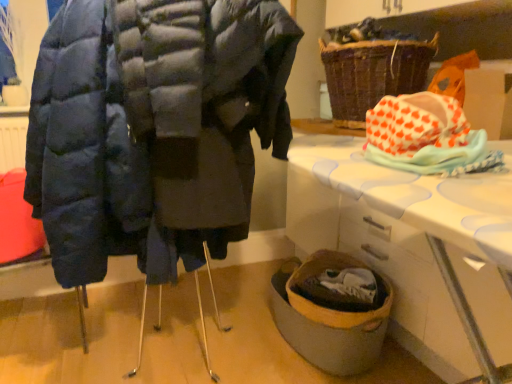
Question: Does matte blue puffer coat at left appear on the left side of orange heart-patterned fabric at upper right?

Choices:
 (A) yes
 (B) no

Answer: (A)

Question: Is matte blue puffer coat at left oriented away from orange heart-patterned fabric at upper right?

Choices:
 (A) no
 (B) yes

Answer: (A)

Question: From a real-world perspective, is matte blue puffer coat at left physically above orange heart-patterned fabric at upper right?

Choices:
 (A) no
 (B) yes

Answer: (A)

Question: Considering the relative sizes of matte blue puffer coat at left and orange heart-patterned fabric at upper right in the image provided, is matte blue puffer coat at left thinner than orange heart-patterned fabric at upper right?

Choices:
 (A) no
 (B) yes

Answer: (A)

Question: From a real-world perspective, is matte blue puffer coat at left located beneath orange heart-patterned fabric at upper right?

Choices:
 (A) no
 (B) yes

Answer: (B)

Question: From a real-world perspective, is matte blue puffer coat at left physically located above or below brown woven basket at upper right?

Choices:
 (A) above
 (B) below

Answer: (B)

Question: Based on their sizes in the image, would you say matte blue puffer coat at left is bigger or smaller than brown woven basket at upper right?

Choices:
 (A) big
 (B) small

Answer: (A)

Question: Relative to brown woven basket at upper right, is matte blue puffer coat at left in front or behind?

Choices:
 (A) front
 (B) behind

Answer: (A)

Question: Is matte blue puffer coat at left wider or thinner than brown woven basket at upper right?

Choices:
 (A) wide
 (B) thin

Answer: (A)

Question: From the image's perspective, is brown woven basket at upper right located above or below matte blue puffer coat at left?

Choices:
 (A) below
 (B) above

Answer: (B)

Question: In the image, is brown woven basket at upper right positioned in front of or behind matte blue puffer coat at left?

Choices:
 (A) front
 (B) behind

Answer: (B)

Question: Is brown woven basket at upper right taller or shorter than matte blue puffer coat at left?

Choices:
 (A) tall
 (B) short

Answer: (B)

Question: Visually, is brown woven basket at upper right positioned to the left or to the right of matte blue puffer coat at left?

Choices:
 (A) right
 (B) left

Answer: (A)

Question: From the image's perspective, is orange heart-patterned fabric at upper right positioned above or below white plastic table at lower right?

Choices:
 (A) above
 (B) below

Answer: (A)

Question: Is orange heart-patterned fabric at upper right in front of or behind white plastic table at lower right in the image?

Choices:
 (A) behind
 (B) front

Answer: (B)